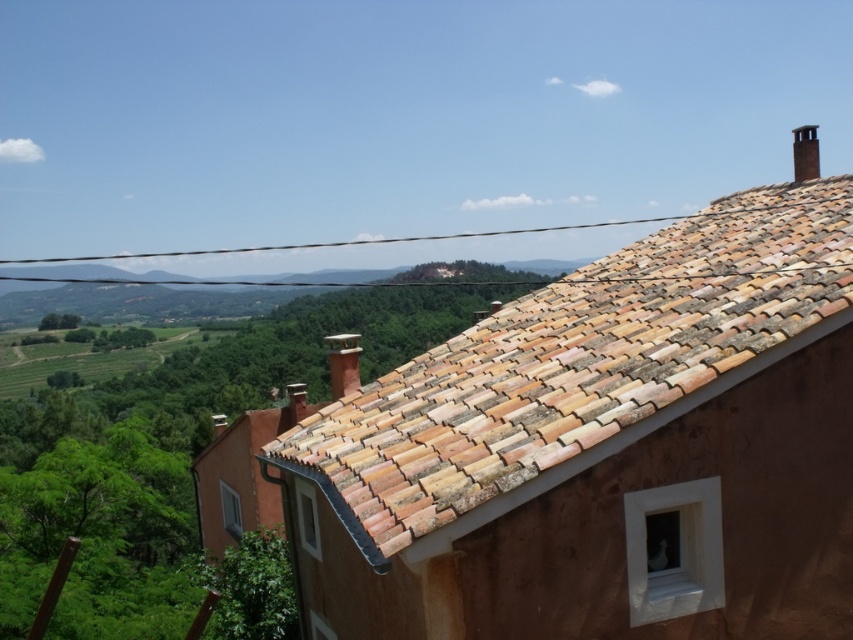
Question: Is terracotta tiles at upper right below black brick chimney at upper right?

Choices:
 (A) yes
 (B) no

Answer: (A)

Question: Can you confirm if terracotta tiles at upper right is positioned to the left of black brick chimney at upper right?

Choices:
 (A) no
 (B) yes

Answer: (B)

Question: Is terracotta tiles at upper right wider than black brick chimney at upper right?

Choices:
 (A) no
 (B) yes

Answer: (A)

Question: Which point is closer to the camera taking this photo?

Choices:
 (A) tap(610, 364)
 (B) tap(801, 148)

Answer: (A)